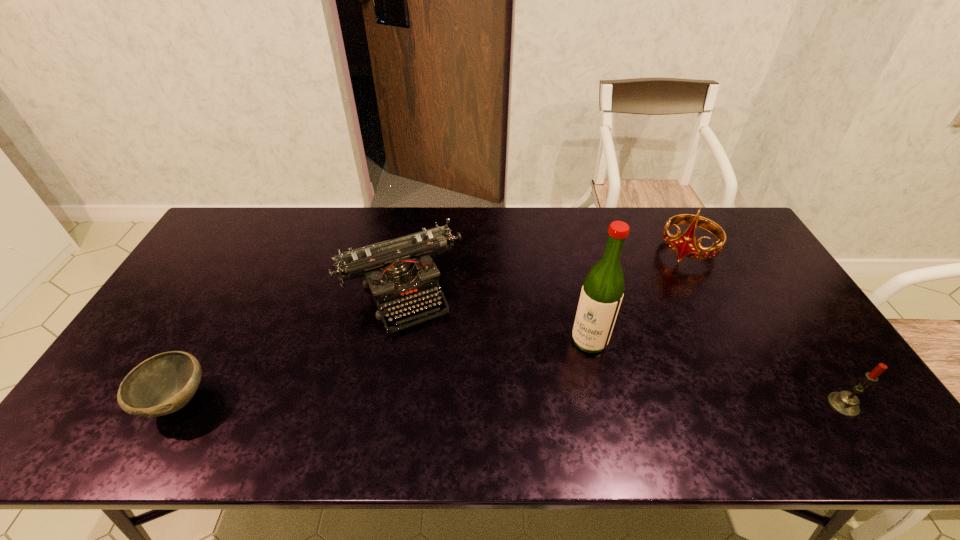
Locate an element on the screen. The width and height of the screenshot is (960, 540). vacant area situated 0.200m on the keyboard of the typewriter is located at coordinates (453, 387).

You are a GUI agent. You are given a task and a screenshot of the screen. Output one action in this format:
    pyautogui.click(x=<x>, y=<y>)
    Task: Click on the vacant area situated 0.100m on the keyboard of the typewriter
    Image resolution: width=960 pixels, height=540 pixels.
    Given the screenshot: What is the action you would take?
    pyautogui.click(x=438, y=357)

Identify the location of vacant space located on the keyboard of the typewriter. (440, 360).

Where is `vacant space located on the front-facing side of the second tallest object`? The height and width of the screenshot is (540, 960). vacant space located on the front-facing side of the second tallest object is located at coordinates pos(642,315).

Locate an element on the screen. This screenshot has height=540, width=960. free point located 0.160m on the front-facing side of the second tallest object is located at coordinates (657, 295).

You are a GUI agent. You are given a task and a screenshot of the screen. Output one action in this format:
    pyautogui.click(x=<x>, y=<y>)
    Task: Click on the free space located 0.060m on the front-facing side of the second tallest object
    
    Given the screenshot: What is the action you would take?
    pyautogui.click(x=669, y=277)

Where is `vacant region located 0.140m on the label of the tallest object`? The width and height of the screenshot is (960, 540). vacant region located 0.140m on the label of the tallest object is located at coordinates (555, 389).

This screenshot has width=960, height=540. In order to click on free location located 0.090m on the label of the tallest object in this screenshot , I will do click(564, 375).

Image resolution: width=960 pixels, height=540 pixels. Identify the location of vacant region located on the label of the tallest object. (542, 406).

In order to click on object present at the far edge in this screenshot , I will do `click(685, 245)`.